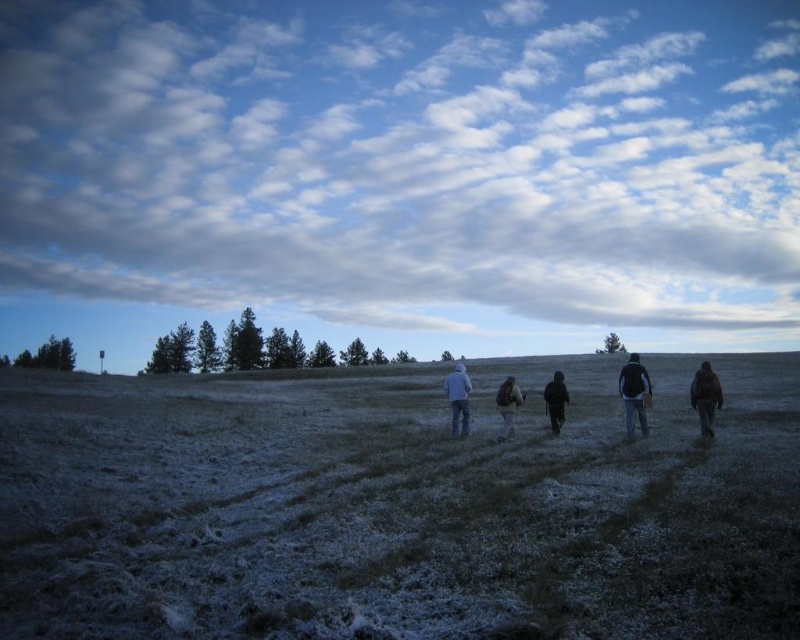
You are standing at the point labeled as point (396, 508) in the image. What is the immediate surface you are standing on?

The immediate surface at point (396, 508) is frosted grass at center.

You are standing in the frosty field and looking up. Where exactly is the cloudy sky at upper center located in terms of coordinates?

The cloudy sky at upper center is located at coordinates point (406, 161).